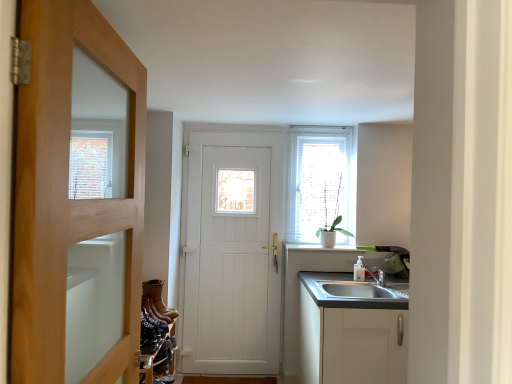
Question: Looking at their shapes, would you say white textured window at upper right is wider or thinner than leather at lower left, which appears as the fourth shoe when viewed from the back?

Choices:
 (A) wide
 (B) thin

Answer: (B)

Question: Is point (298, 203) closer or farther from the camera than point (157, 324)?

Choices:
 (A) farther
 (B) closer

Answer: (A)

Question: Which object is the closest to the leather at lower left, arranged as the second shoe when ordered from the bottom?

Choices:
 (A) brown suede boot at lower left, the 3th shoe when ordered from bottom to top
 (B) leather boots at lower left, the first shoe when ordered from back to front
 (C) leather boot at lower left, which appears as the 1th shoe when ordered from the bottom
 (D) white wooden door at center, which appears as the second door when viewed from the front
 (E) wooden door at left, marked as the 2th door in a back-to-front arrangement

Answer: (A)

Question: Which of these objects is positioned farthest from the leather boot at lower left, the fourth shoe from the top?

Choices:
 (A) leather boots at lower left, the first shoe positioned from the top
 (B) brown suede boot at lower left, which is counted as the second shoe, starting from the top
 (C) white textured window at upper right
 (D) leather at lower left, which appears as the fourth shoe when viewed from the back
 (E) white ceramic plant at upper right

Answer: (C)